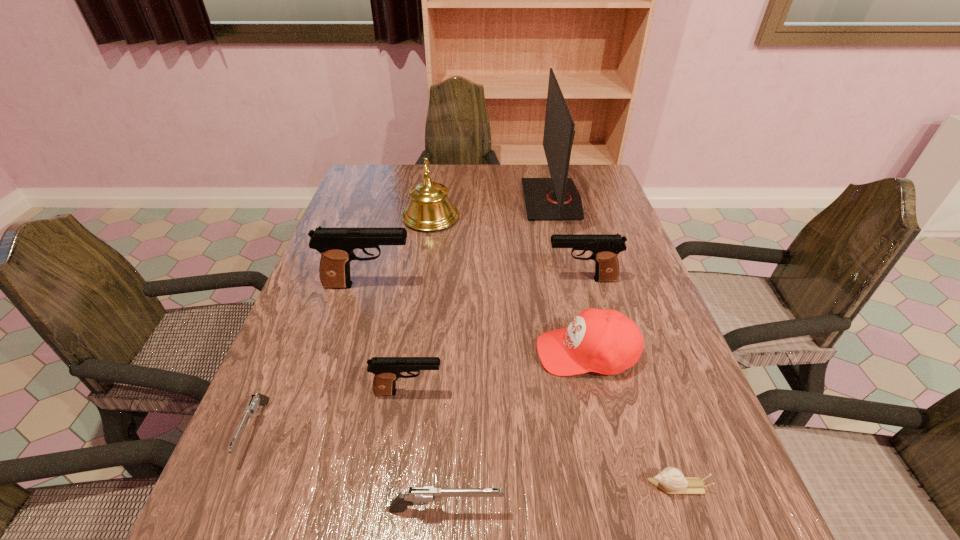
Locate an element on the screen. blank region between the escargot and the fourth tallest object is located at coordinates (630, 383).

The image size is (960, 540). I want to click on vacant space in between the tallest pistol and the second biggest black pistol, so 475,282.

Locate which object is the fifth closest to the biggest black pistol. Please provide its 2D coordinates. Your answer should be formatted as a tuple, i.e. [(x, y)], where the tuple contains the x and y coordinates of a point satisfying the conditions above.

[(605, 247)]

Identify which object is the nearest to the gold bell. Please provide its 2D coordinates. Your answer should be formatted as a tuple, i.e. [(x, y)], where the tuple contains the x and y coordinates of a point satisfying the conditions above.

[(336, 245)]

You are a GUI agent. You are given a task and a screenshot of the screen. Output one action in this format:
    pyautogui.click(x=<x>, y=<y>)
    Task: Click on the pistol identified as the second closest to the third tallest pistol
    The width and height of the screenshot is (960, 540).
    Given the screenshot: What is the action you would take?
    pyautogui.click(x=421, y=495)

Locate which pistol ranks in proximity to the rightmost pistol. Please provide its 2D coordinates. Your answer should be formatted as a tuple, i.e. [(x, y)], where the tuple contains the x and y coordinates of a point satisfying the conditions above.

[(336, 245)]

The height and width of the screenshot is (540, 960). In order to click on the second closest black pistol to the tallest object in this screenshot , I will do `click(336, 245)`.

Identify which black pistol is located as the third nearest to the baseball cap. Please provide its 2D coordinates. Your answer should be formatted as a tuple, i.e. [(x, y)], where the tuple contains the x and y coordinates of a point satisfying the conditions above.

[(336, 245)]

I want to click on vacant space that satisfies the following two spatial constraints: 1. at the barrel of the tallest pistol; 2. on the front-facing side of the left silver pistol, so coord(326,430).

This screenshot has width=960, height=540. What are the coordinates of `vacant space that satisfies the following two spatial constraints: 1. on the front side of the bell; 2. at the barrel of the tallest pistol` in the screenshot? It's located at (420, 285).